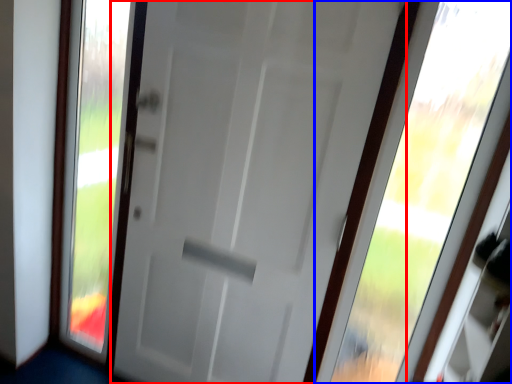
Question: Among these objects, which one is farthest to the camera, door (highlighted by a red box) or window (highlighted by a blue box)?

Choices:
 (A) door
 (B) window

Answer: (A)